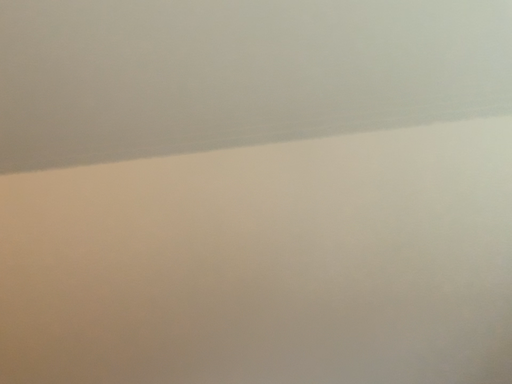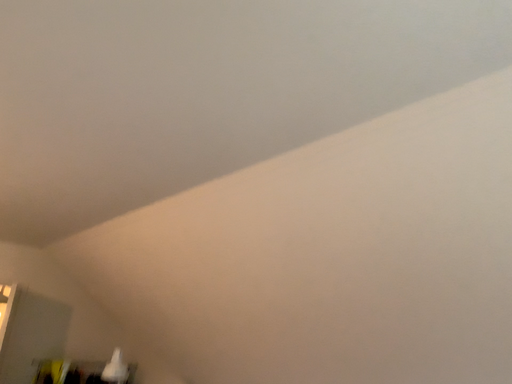
Question: How did the camera likely rotate when shooting the video?

Choices:
 (A) rotated downward
 (B) rotated upward

Answer: (A)